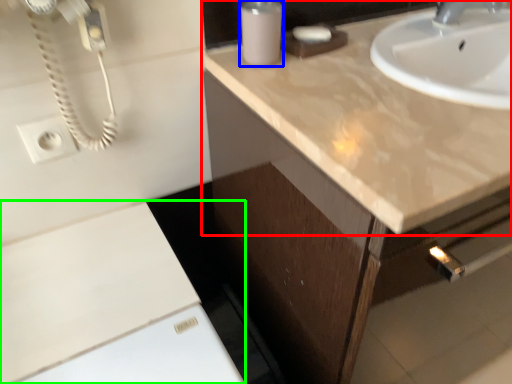
Question: Which object is the farthest from countertop (highlighted by a red box)? Choose among these: soap dispenser (highlighted by a blue box) or cabinetry (highlighted by a green box).

Choices:
 (A) soap dispenser
 (B) cabinetry

Answer: (B)